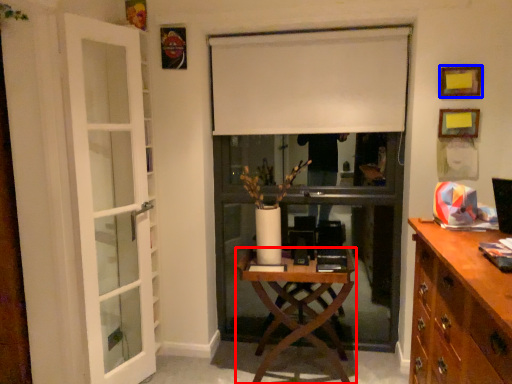
Question: Which point is closer to the camera, desk (highlighted by a red box) or picture frame (highlighted by a blue box)?

Choices:
 (A) desk
 (B) picture frame

Answer: (A)